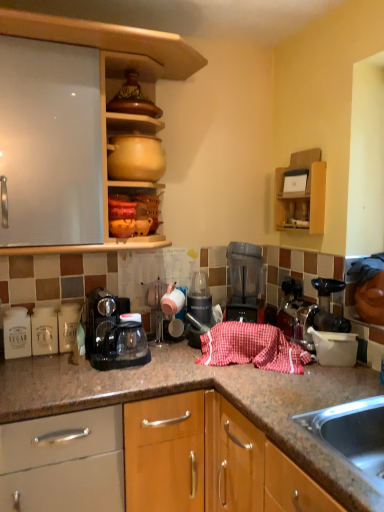
Question: Would you say translucent plastic blender at center is outside matte ceramic pots at upper center, placed as the first cabinetry when sorted from left to right?

Choices:
 (A) yes
 (B) no

Answer: (A)

Question: From the image's perspective, is translucent plastic blender at center under matte ceramic pots at upper center, placed as the first cabinetry when sorted from left to right?

Choices:
 (A) no
 (B) yes

Answer: (B)

Question: Considering the relative sizes of translucent plastic blender at center and matte ceramic pots at upper center, placed as the first cabinetry when sorted from left to right, in the image provided, is translucent plastic blender at center bigger than matte ceramic pots at upper center, placed as the first cabinetry when sorted from left to right,?

Choices:
 (A) yes
 (B) no

Answer: (B)

Question: Is translucent plastic blender at center to the left of matte ceramic pots at upper center, the 2th cabinetry from the right, from the viewer's perspective?

Choices:
 (A) yes
 (B) no

Answer: (B)

Question: Does translucent plastic blender at center have a smaller size compared to matte ceramic pots at upper center, the 2th cabinetry from the right?

Choices:
 (A) no
 (B) yes

Answer: (B)

Question: Would you say matte ceramic pots at upper center, placed as the first cabinetry when sorted from left to right, is inside or outside wooden shelf at upper right, which is counted as the 2th cabinetry, starting from the left?

Choices:
 (A) outside
 (B) inside

Answer: (A)

Question: From a real-world perspective, is matte ceramic pots at upper center, the 2th cabinetry from the right, above or below wooden shelf at upper right, which is the 1th cabinetry in right-to-left order?

Choices:
 (A) below
 (B) above

Answer: (B)

Question: Considering their positions, is matte ceramic pots at upper center, the 2th cabinetry from the right, located in front of or behind wooden shelf at upper right, which is the 1th cabinetry in right-to-left order?

Choices:
 (A) behind
 (B) front

Answer: (B)

Question: In terms of size, does matte ceramic pots at upper center, placed as the first cabinetry when sorted from left to right, appear bigger or smaller than wooden shelf at upper right, which is counted as the 2th cabinetry, starting from the left?

Choices:
 (A) small
 (B) big

Answer: (B)

Question: From a real-world perspective, is matte yellow clay pot at upper center, placed as the 1th appliance when sorted from left to right, above or below matte ceramic pots at upper center, placed as the first cabinetry when sorted from left to right?

Choices:
 (A) below
 (B) above

Answer: (A)

Question: Considering the positions of matte yellow clay pot at upper center, which is the 2th appliance in back-to-front order, and matte ceramic pots at upper center, the 2th cabinetry from the right, in the image, is matte yellow clay pot at upper center, which is the 2th appliance in back-to-front order, wider or thinner than matte ceramic pots at upper center, the 2th cabinetry from the right,?

Choices:
 (A) wide
 (B) thin

Answer: (B)

Question: Is matte yellow clay pot at upper center, the first appliance positioned from the top, taller or shorter than matte ceramic pots at upper center, placed as the first cabinetry when sorted from left to right?

Choices:
 (A) tall
 (B) short

Answer: (B)

Question: From the image's perspective, is matte yellow clay pot at upper center, the first appliance positioned from the top, above or below matte ceramic pots at upper center, placed as the first cabinetry when sorted from left to right?

Choices:
 (A) above
 (B) below

Answer: (B)

Question: Do you think translucent plastic blender at center is within matte yellow clay pot at upper center, the second appliance when ordered from right to left, or outside of it?

Choices:
 (A) inside
 (B) outside

Answer: (B)

Question: Visually, is translucent plastic blender at center positioned to the left or to the right of matte yellow clay pot at upper center, which is counted as the 2th appliance, starting from the bottom?

Choices:
 (A) right
 (B) left

Answer: (A)